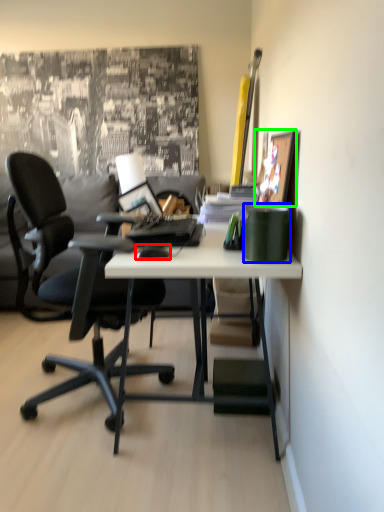
Question: Considering the real-world distances, which object is farthest from mouse (highlighted by a red box)? stationery (highlighted by a blue box) or picture frame (highlighted by a green box)?

Choices:
 (A) stationery
 (B) picture frame

Answer: (B)